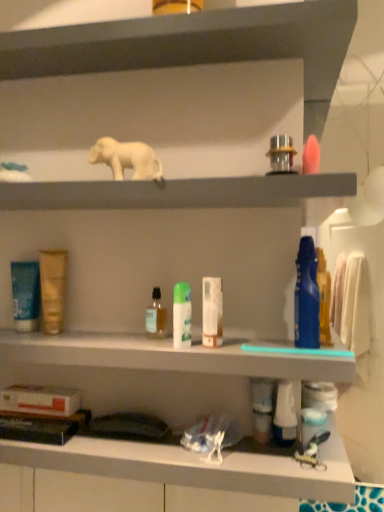
Question: From a real-world perspective, is white matte elephant at upper center positioned under white matte elephant at upper center, placed as the 1th shelf when sorted from bottom to top, based on gravity?

Choices:
 (A) no
 (B) yes

Answer: (A)

Question: Does white matte elephant at upper center have a greater height compared to white matte elephant at upper center, which is the second shelf from top to bottom?

Choices:
 (A) no
 (B) yes

Answer: (B)

Question: Could you tell me if white matte elephant at upper center is turned towards white matte elephant at upper center, which is the second shelf from top to bottom?

Choices:
 (A) no
 (B) yes

Answer: (A)

Question: From a real-world perspective, does white matte elephant at upper center stand above white matte elephant at upper center, which is the second shelf from top to bottom?

Choices:
 (A) no
 (B) yes

Answer: (B)

Question: Does white matte elephant at upper center appear on the left side of white matte elephant at upper center, which is the second shelf from top to bottom?

Choices:
 (A) no
 (B) yes

Answer: (A)

Question: Is white matte elephant at upper center positioned far away from white matte elephant at upper center, placed as the 1th shelf when sorted from bottom to top?

Choices:
 (A) yes
 (B) no

Answer: (B)

Question: Does white matte box at lower center have a lesser height compared to white matte elephant at upper center, which is the second shelf from top to bottom?

Choices:
 (A) no
 (B) yes

Answer: (A)

Question: Is white matte box at lower center located outside white matte elephant at upper center, which is the second shelf from top to bottom?

Choices:
 (A) yes
 (B) no

Answer: (A)

Question: Is white matte box at lower center looking in the opposite direction of white matte elephant at upper center, which is the second shelf from top to bottom?

Choices:
 (A) yes
 (B) no

Answer: (B)

Question: Can you confirm if white matte box at lower center is taller than white matte elephant at upper center, which is the second shelf from top to bottom?

Choices:
 (A) yes
 (B) no

Answer: (A)

Question: Is white matte box at lower center wider than white matte elephant at upper center, placed as the 1th shelf when sorted from bottom to top?

Choices:
 (A) no
 (B) yes

Answer: (A)

Question: Does white matte box at lower center have a lesser width compared to white matte elephant at upper center, which is the second shelf from top to bottom?

Choices:
 (A) no
 (B) yes

Answer: (B)

Question: Can you confirm if metallic silver faucet at upper center, which is counted as the 3th toiletry, starting from the right, is smaller than white matte tube at center, the fourth toiletry when ordered from left to right?

Choices:
 (A) no
 (B) yes

Answer: (A)